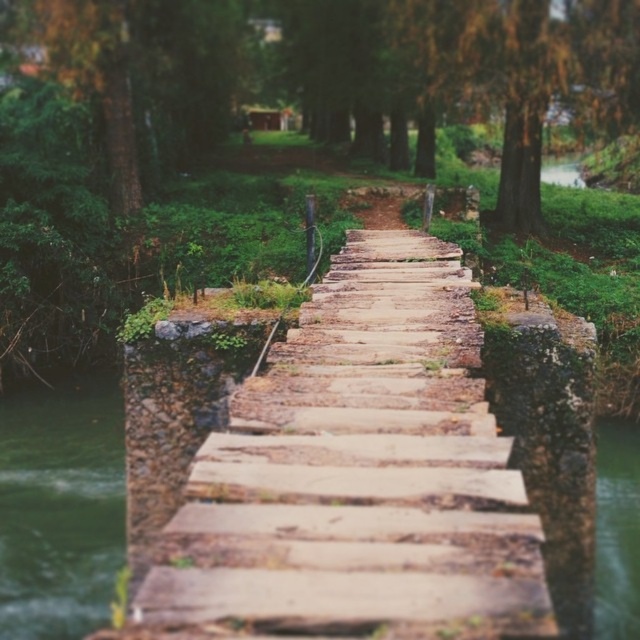
Is weathered wood path at center bigger than green liquid at lower left?

No.

Who is higher up, weathered wood path at center or green liquid at lower left?

weathered wood path at center

This screenshot has height=640, width=640. Identify the location of weathered wood path at center. (358, 474).

This screenshot has height=640, width=640. Identify the location of weathered wood path at center. (358, 474).